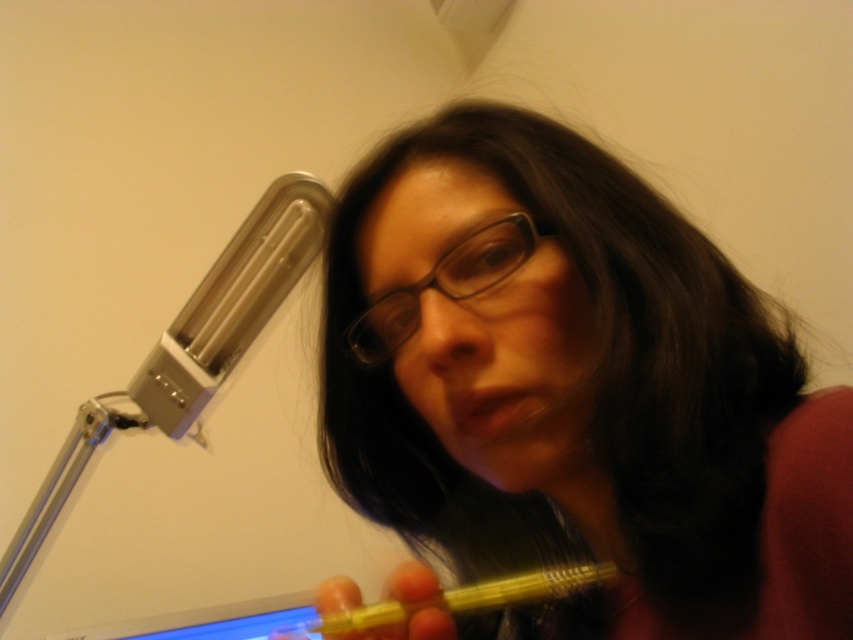
Which is more to the left, translucent yellow pen at center or transparent plastic glasses at center?

From the viewer's perspective, transparent plastic glasses at center appears more on the left side.

Does point (798, 634) lie behind point (508, 214)?

No.

Image resolution: width=853 pixels, height=640 pixels. Identify the location of translucent yellow pen at center. (573, 394).